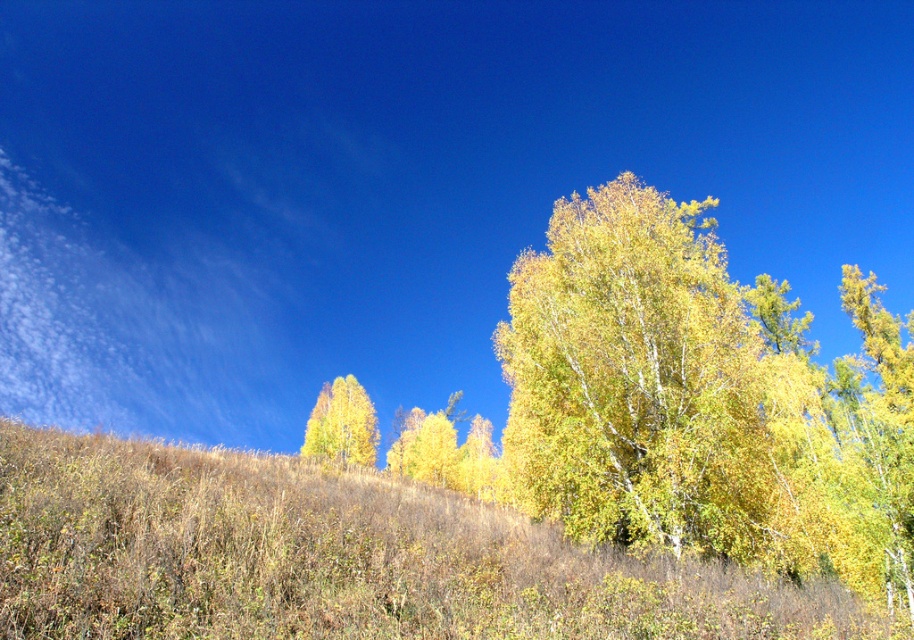
Question: Can you confirm if brown dry grass at lower left is thinner than yellow matte tree at lower left?

Choices:
 (A) no
 (B) yes

Answer: (A)

Question: Which object is the farthest from the brown dry grass at lower left?

Choices:
 (A) yellow matte tree at lower left
 (B) yellow-green leaves at center

Answer: (A)

Question: Which object appears farthest from the camera in this image?

Choices:
 (A) brown dry grass at lower left
 (B) yellow matte tree at lower left
 (C) yellow-green leaves at center

Answer: (B)

Question: Is yellow-green leaves at center wider than yellow matte tree at lower left?

Choices:
 (A) yes
 (B) no

Answer: (A)

Question: Is yellow-green leaves at center wider than yellow matte tree at lower left?

Choices:
 (A) no
 (B) yes

Answer: (B)

Question: Which object is farther from the camera taking this photo?

Choices:
 (A) yellow-green leaves at center
 (B) yellow matte tree at lower left

Answer: (B)